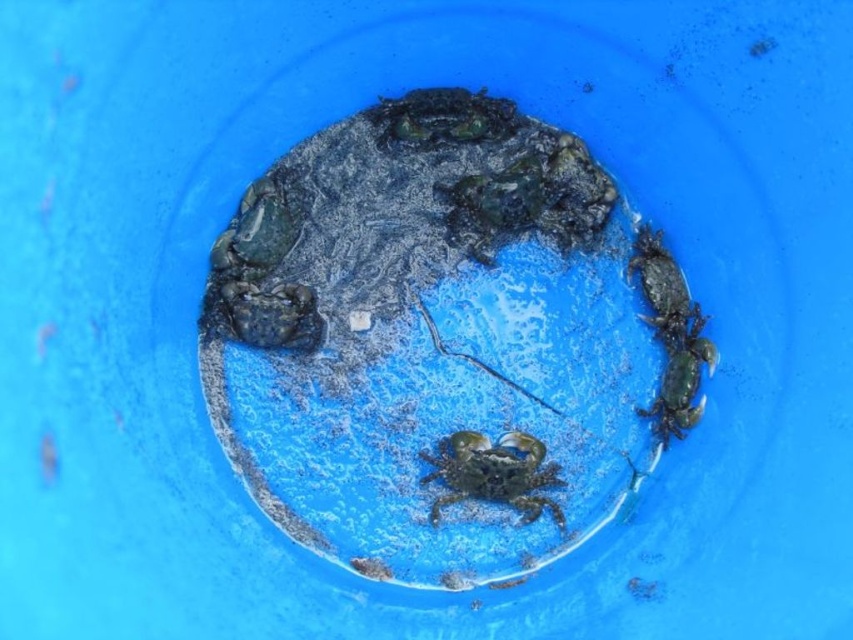
Question: Which point is farther to the camera?

Choices:
 (A) green matte crab at center
 (B) green matte crab at right

Answer: (A)

Question: Among these objects, which one is farthest from the camera?

Choices:
 (A) green matte crab at center
 (B) green matte crab at right

Answer: (A)

Question: Is green matte crab at right bigger than green matte crab at center?

Choices:
 (A) no
 (B) yes

Answer: (B)

Question: Observing the image, what is the correct spatial positioning of green matte crab at right in reference to green matte crab at center?

Choices:
 (A) left
 (B) right

Answer: (B)

Question: Can you confirm if green matte crab at right is bigger than green matte crab at center?

Choices:
 (A) no
 (B) yes

Answer: (B)